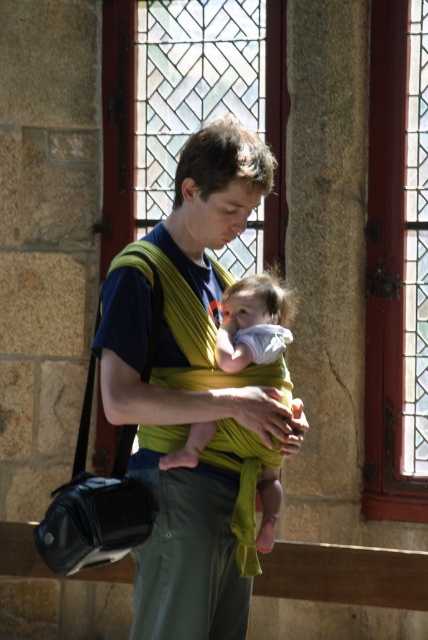
You are a photographer taking a picture of the scene. You want to focus on the soft white cloth at center without the green fabric baby carrier at center overlapping it. Can you adjust your angle to the left to achieve this?

The green fabric baby carrier at center is positioned on the left side of soft white cloth at center. By moving your camera angle to the left, you can avoid overlapping the green fabric baby carrier at center with the soft white cloth at center.

You are an interior designer planning to place a new decorative item in the room. The item needs to be placed at the point marked by coordinates point (189, 554). What object is currently located at that point?

The point (189, 554) marks the green fabric baby carrier at center.